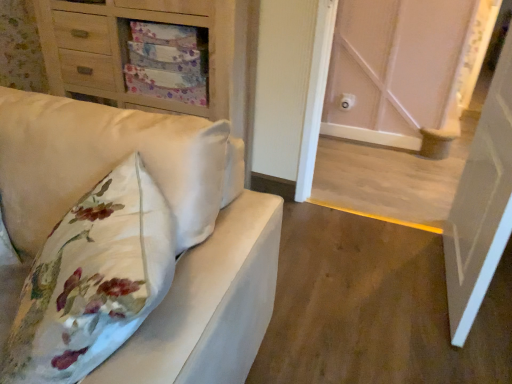
Locate an element on the screen. This screenshot has width=512, height=384. white wood door at center, the second door in the front-to-back sequence is located at coordinates (396, 70).

At what (x,y) coordinates should I click in order to perform the action: click on matte white sofa at left. Please return your answer as a coordinate pair (x, y). The height and width of the screenshot is (384, 512). Looking at the image, I should click on (176, 227).

Image resolution: width=512 pixels, height=384 pixels. I want to click on matte wood chest of drawers at upper left, so click(165, 23).

How distant is white glossy door at right, which ranks as the 2th door in back-to-front order, from matte white sofa at left?

white glossy door at right, which ranks as the 2th door in back-to-front order, is 98.04 centimeters away from matte white sofa at left.

Can you confirm if white glossy door at right, acting as the 1th door starting from the front, is smaller than matte white sofa at left?

Indeed, white glossy door at right, acting as the 1th door starting from the front, has a smaller size compared to matte white sofa at left.

Between white glossy door at right, which ranks as the 2th door in back-to-front order, and matte white sofa at left, which one has more height?

With more height is white glossy door at right, which ranks as the 2th door in back-to-front order.

Is point (487, 105) more distant than point (160, 177)?

Yes, it is.

Is white wood door at center, arranged as the 1th door when viewed from the back, positioned beyond the bounds of matte white sofa at left?

Indeed, white wood door at center, arranged as the 1th door when viewed from the back, is completely outside matte white sofa at left.

Based on their sizes in the image, would you say white wood door at center, the second door in the front-to-back sequence, is bigger or smaller than matte white sofa at left?

white wood door at center, the second door in the front-to-back sequence, is smaller than matte white sofa at left.

Looking at this image, how different are the orientations of white wood door at center, the second door in the front-to-back sequence, and matte white sofa at left in degrees?

1.5 degrees.

Does white wood door at center, arranged as the 1th door when viewed from the back, turn towards matte white sofa at left?

No, white wood door at center, arranged as the 1th door when viewed from the back, is not aimed at matte white sofa at left.

In the scene shown: From the image's perspective, is matte white sofa at left positioned above or below white wood door at center, the second door in the front-to-back sequence?

matte white sofa at left is below white wood door at center, the second door in the front-to-back sequence.

How much distance is there between matte white sofa at left and white wood door at center, the second door in the front-to-back sequence?

The distance of matte white sofa at left from white wood door at center, the second door in the front-to-back sequence, is 6.91 feet.

In the scene shown: Considering the positions of objects matte white sofa at left and white wood door at center, arranged as the 1th door when viewed from the back, in the image provided, who is more to the left, matte white sofa at left or white wood door at center, arranged as the 1th door when viewed from the back,?

matte white sofa at left is more to the left.

Is matte white sofa at left oriented away from white wood door at center, arranged as the 1th door when viewed from the back?

Yes, matte white sofa at left is positioned with its back facing white wood door at center, arranged as the 1th door when viewed from the back.

From a real-world perspective, between matte wood chest of drawers at upper left and white wood door at center, arranged as the 1th door when viewed from the back, who is vertically higher?

white wood door at center, arranged as the 1th door when viewed from the back.

Is matte wood chest of drawers at upper left looking in the opposite direction of white wood door at center, the second door in the front-to-back sequence?

That's not correct — matte wood chest of drawers at upper left is not looking away from white wood door at center, the second door in the front-to-back sequence.

Considering the points (230, 69) and (452, 92), which point is behind, point (230, 69) or point (452, 92)?

The point (452, 92) is behind.

Considering their positions, is matte wood chest of drawers at upper left located in front of or behind white wood door at center, the second door in the front-to-back sequence?

Clearly, matte wood chest of drawers at upper left is behind white wood door at center, the second door in the front-to-back sequence.

From the image's perspective, is matte wood chest of drawers at upper left beneath matte white sofa at left?

No.

From their relative heights in the image, would you say matte wood chest of drawers at upper left is taller or shorter than matte white sofa at left?

In the image, matte wood chest of drawers at upper left appears to be taller than matte white sofa at left.

Are matte wood chest of drawers at upper left and matte white sofa at left making contact?

matte wood chest of drawers at upper left and matte white sofa at left are clearly separated.

Which object is positioned more to the left, matte wood chest of drawers at upper left or matte white sofa at left?

From the viewer's perspective, matte white sofa at left appears more on the left side.

Is white wood door at center, the second door in the front-to-back sequence, oriented away from white glossy door at right, acting as the 1th door starting from the front?

white wood door at center, the second door in the front-to-back sequence, is not turned away from white glossy door at right, acting as the 1th door starting from the front.

In the scene shown: Is white wood door at center, the second door in the front-to-back sequence, spatially inside white glossy door at right, which ranks as the 2th door in back-to-front order, or outside of it?

white wood door at center, the second door in the front-to-back sequence, is not inside white glossy door at right, which ranks as the 2th door in back-to-front order, it's outside.

From the image's perspective, would you say white wood door at center, arranged as the 1th door when viewed from the back, is shown under white glossy door at right, acting as the 1th door starting from the front?

Actually, white wood door at center, arranged as the 1th door when viewed from the back, appears above white glossy door at right, acting as the 1th door starting from the front, in the image.

Does white wood door at center, the second door in the front-to-back sequence, appear on the left side of white glossy door at right, acting as the 1th door starting from the front?

Correct, you'll find white wood door at center, the second door in the front-to-back sequence, to the left of white glossy door at right, acting as the 1th door starting from the front.

Is white glossy door at right, acting as the 1th door starting from the front, aimed at white wood door at center, arranged as the 1th door when viewed from the back?

Yes, white glossy door at right, acting as the 1th door starting from the front, faces towards white wood door at center, arranged as the 1th door when viewed from the back.

Measure the distance from white glossy door at right, acting as the 1th door starting from the front, to white wood door at center, the second door in the front-to-back sequence.

white glossy door at right, acting as the 1th door starting from the front, is 1.20 meters from white wood door at center, the second door in the front-to-back sequence.

Consider the image. Is white glossy door at right, which ranks as the 2th door in back-to-front order, bigger or smaller than white wood door at center, arranged as the 1th door when viewed from the back?

In the image, white glossy door at right, which ranks as the 2th door in back-to-front order, appears to be larger than white wood door at center, arranged as the 1th door when viewed from the back.

Considering the relative sizes of white glossy door at right, acting as the 1th door starting from the front, and white wood door at center, arranged as the 1th door when viewed from the back, in the image provided, is white glossy door at right, acting as the 1th door starting from the front, thinner than white wood door at center, arranged as the 1th door when viewed from the back,?

No.

I want to click on furniture in front of the white glossy door at right, which ranks as the 2th door in back-to-front order, so [176, 227].

Identify the location of door that is the 1st object to the right of the matte white sofa at left, starting at the anchor. (396, 70).

When comparing their distances from white glossy door at right, which ranks as the 2th door in back-to-front order, does white wood door at center, the second door in the front-to-back sequence, or matte white sofa at left seem further?

white wood door at center, the second door in the front-to-back sequence, is positioned further to the anchor white glossy door at right, which ranks as the 2th door in back-to-front order.

Considering their positions, is white glossy door at right, which ranks as the 2th door in back-to-front order, positioned closer to matte white sofa at left than white wood door at center, arranged as the 1th door when viewed from the back?

white glossy door at right, which ranks as the 2th door in back-to-front order, lies closer to matte white sofa at left than the other object.

Looking at the image, which one is located closer to white glossy door at right, which ranks as the 2th door in back-to-front order, matte wood chest of drawers at upper left or matte white sofa at left?

matte white sofa at left is positioned closer to the anchor white glossy door at right, which ranks as the 2th door in back-to-front order.

Estimate the real-world distances between objects in this image. Which object is closer to white glossy door at right, which ranks as the 2th door in back-to-front order, matte white sofa at left or matte wood chest of drawers at upper left?

The object closer to white glossy door at right, which ranks as the 2th door in back-to-front order, is matte white sofa at left.

Looking at the image, which one is located closer to matte wood chest of drawers at upper left, white wood door at center, the second door in the front-to-back sequence, or white glossy door at right, acting as the 1th door starting from the front?

Among the two, white glossy door at right, acting as the 1th door starting from the front, is located nearer to matte wood chest of drawers at upper left.

Based on their spatial positions, is matte wood chest of drawers at upper left or white wood door at center, the second door in the front-to-back sequence, closer to white glossy door at right, acting as the 1th door starting from the front?

Based on the image, white wood door at center, the second door in the front-to-back sequence, appears to be nearer to white glossy door at right, acting as the 1th door starting from the front.

Considering their positions, is matte wood chest of drawers at upper left positioned further to white wood door at center, arranged as the 1th door when viewed from the back, than matte white sofa at left?

matte white sofa at left lies further to white wood door at center, arranged as the 1th door when viewed from the back, than the other object.

From the image, which object appears to be nearer to matte white sofa at left, matte wood chest of drawers at upper left or white glossy door at right, acting as the 1th door starting from the front?

Based on the image, matte wood chest of drawers at upper left appears to be nearer to matte white sofa at left.

At what (x,y) coordinates should I click in order to perform the action: click on chest of drawers between matte white sofa at left and white wood door at center, the second door in the front-to-back sequence. Please return your answer as a coordinate pair (x, y). The width and height of the screenshot is (512, 384). Looking at the image, I should click on (165, 23).

You are a GUI agent. You are given a task and a screenshot of the screen. Output one action in this format:
    pyautogui.click(x=<x>, y=<y>)
    Task: Click on the chest of drawers between matte white sofa at left and white glossy door at right, which ranks as the 2th door in back-to-front order
    
    Given the screenshot: What is the action you would take?
    pyautogui.click(x=165, y=23)

Image resolution: width=512 pixels, height=384 pixels. I want to click on door located between matte wood chest of drawers at upper left and white glossy door at right, which ranks as the 2th door in back-to-front order, in the left-right direction, so click(x=396, y=70).

The image size is (512, 384). What are the coordinates of `door situated between matte white sofa at left and white glossy door at right, which ranks as the 2th door in back-to-front order, from left to right` in the screenshot? It's located at (396, 70).